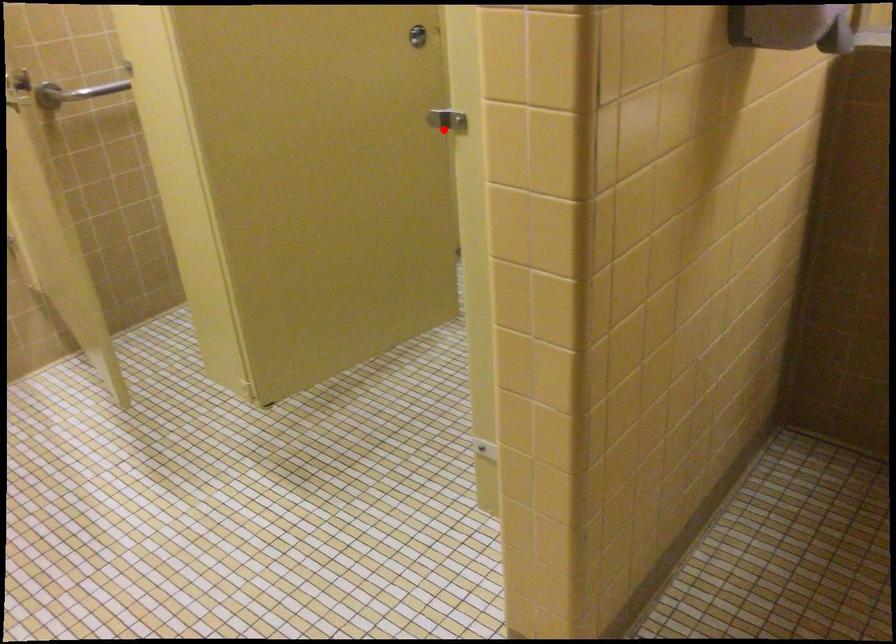
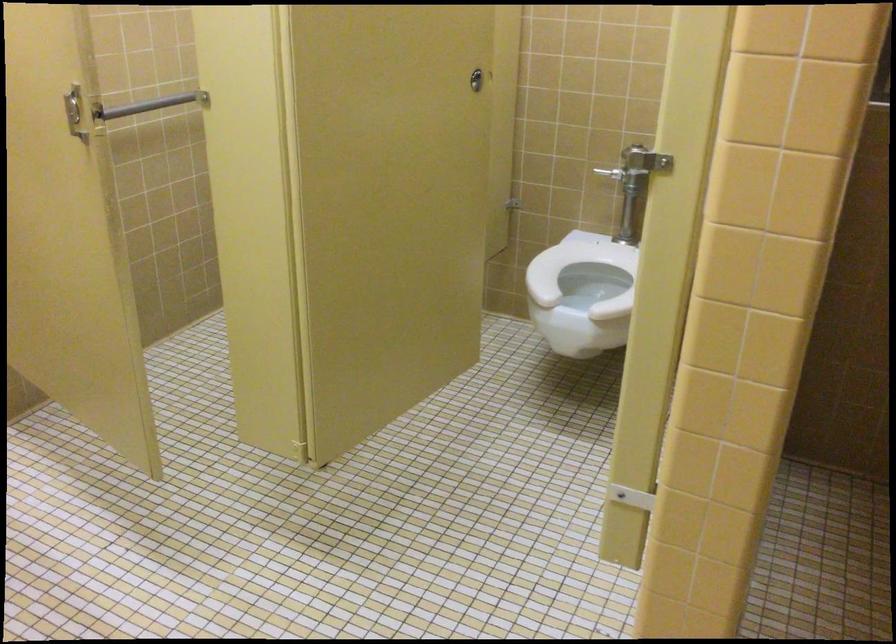
The point at the highlighted location is marked in the first image. Where is the corresponding point in the second image?

(644, 160)